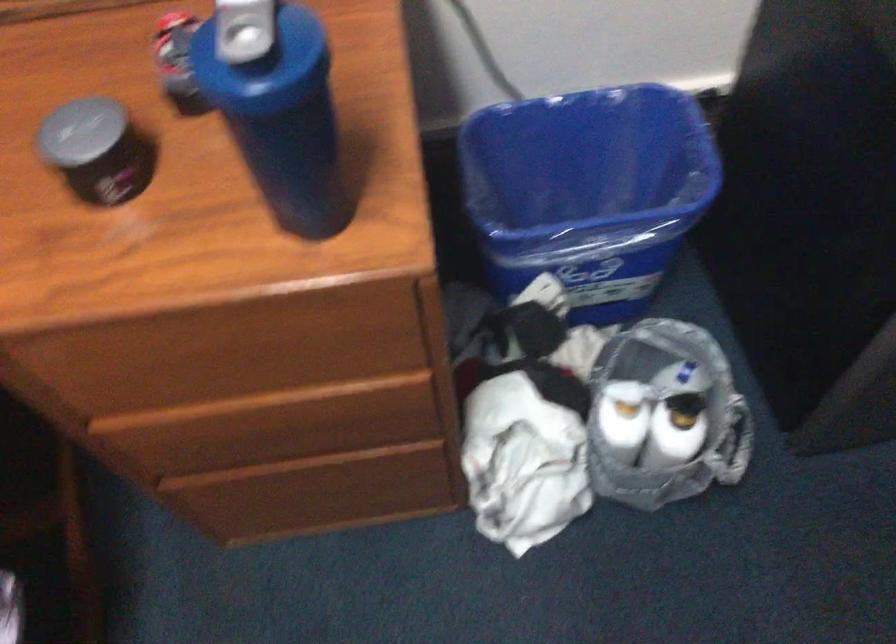
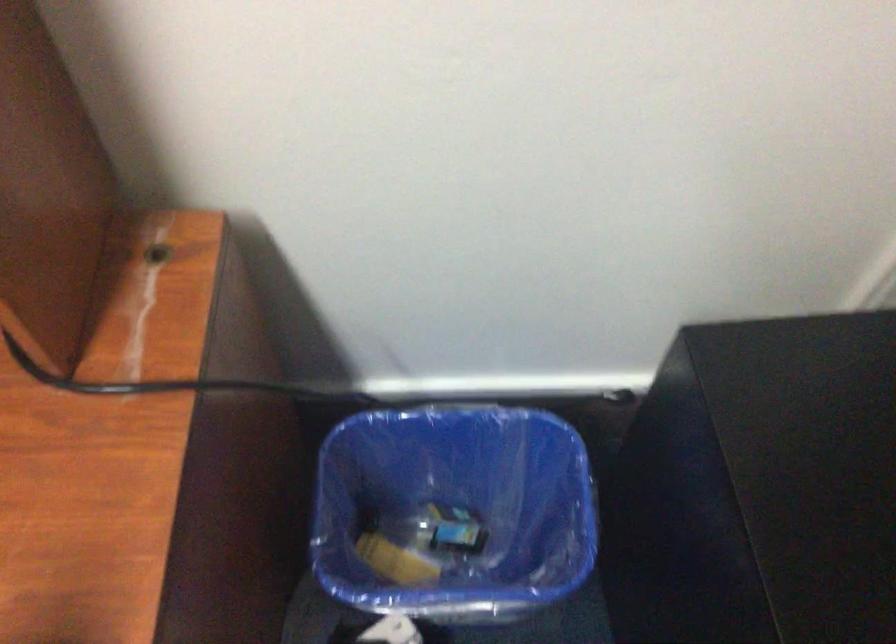
Looking at this image, in a continuous first-person perspective shot, in which direction is the camera moving?

The cameraman moved toward right, forward.